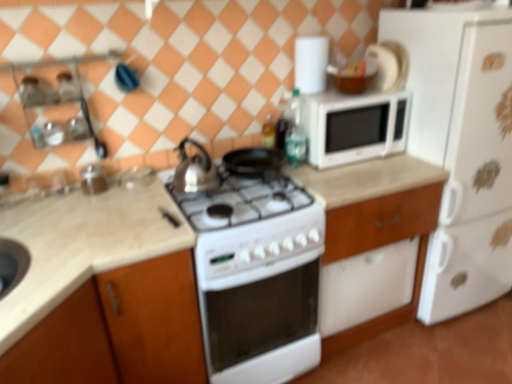
Where is `free space to the right of transparent glass jar at upper left, positioned as the first appliance in bottom-to-top order`? The height and width of the screenshot is (384, 512). free space to the right of transparent glass jar at upper left, positioned as the first appliance in bottom-to-top order is located at coordinates (137, 188).